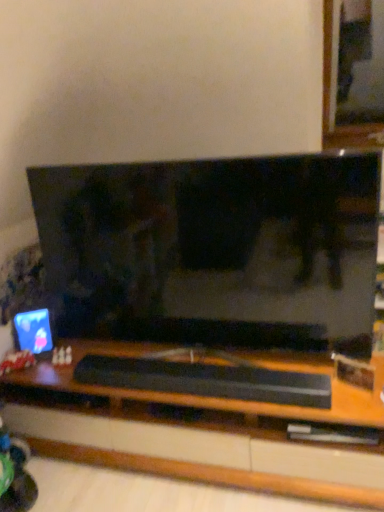
Question: Does plush fabric teddy bear at lower left have a larger size compared to matte plastic computer monitor at left?

Choices:
 (A) no
 (B) yes

Answer: (A)

Question: Can you confirm if plush fabric teddy bear at lower left is shorter than matte plastic computer monitor at left?

Choices:
 (A) no
 (B) yes

Answer: (B)

Question: Can you confirm if plush fabric teddy bear at lower left is positioned to the left of matte plastic computer monitor at left?

Choices:
 (A) no
 (B) yes

Answer: (B)

Question: Is plush fabric teddy bear at lower left positioned with its back to matte plastic computer monitor at left?

Choices:
 (A) yes
 (B) no

Answer: (A)

Question: Considering the relative sizes of plush fabric teddy bear at lower left and matte plastic computer monitor at left in the image provided, is plush fabric teddy bear at lower left smaller than matte plastic computer monitor at left?

Choices:
 (A) no
 (B) yes

Answer: (B)

Question: Would you say plush fabric teddy bear at lower left is inside or outside black matte soundbar at center?

Choices:
 (A) inside
 (B) outside

Answer: (B)

Question: From the image's perspective, is plush fabric teddy bear at lower left positioned above or below black matte soundbar at center?

Choices:
 (A) above
 (B) below

Answer: (A)

Question: Looking at the image, does plush fabric teddy bear at lower left seem bigger or smaller compared to black matte soundbar at center?

Choices:
 (A) small
 (B) big

Answer: (A)

Question: In the image, is plush fabric teddy bear at lower left on the left side or the right side of black matte soundbar at center?

Choices:
 (A) right
 (B) left

Answer: (B)

Question: From a real-world perspective, is black matte soundbar at center positioned above or below plush fabric teddy bear at lower left?

Choices:
 (A) below
 (B) above

Answer: (A)

Question: In terms of height, does black matte soundbar at center look taller or shorter compared to plush fabric teddy bear at lower left?

Choices:
 (A) short
 (B) tall

Answer: (A)

Question: In terms of size, does black matte soundbar at center appear bigger or smaller than plush fabric teddy bear at lower left?

Choices:
 (A) small
 (B) big

Answer: (B)

Question: Considering the relative positions of black matte soundbar at center and plush fabric teddy bear at lower left in the image provided, is black matte soundbar at center to the left or to the right of plush fabric teddy bear at lower left?

Choices:
 (A) left
 (B) right

Answer: (B)

Question: Based on their sizes in the image, would you say black matte soundbar at center is bigger or smaller than matte plastic computer monitor at left?

Choices:
 (A) big
 (B) small

Answer: (A)

Question: From a real-world perspective, is black matte soundbar at center physically located above or below matte plastic computer monitor at left?

Choices:
 (A) below
 (B) above

Answer: (A)